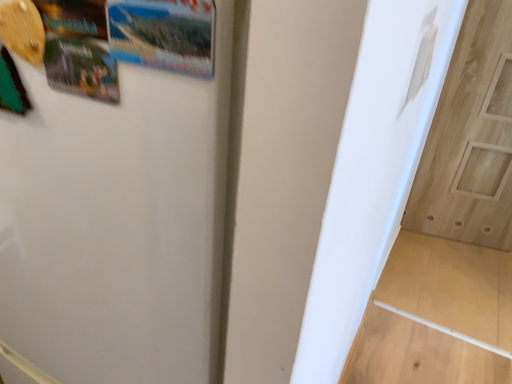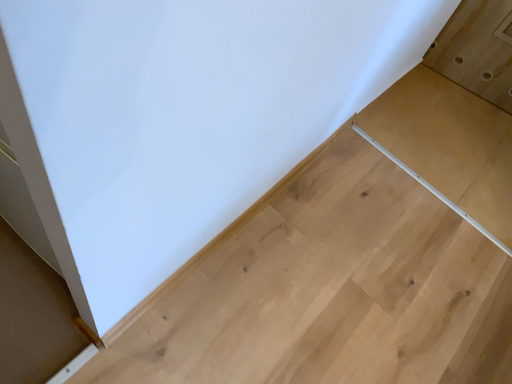
Question: Which way did the camera rotate in the video?

Choices:
 (A) rotated downward
 (B) rotated upward

Answer: (A)